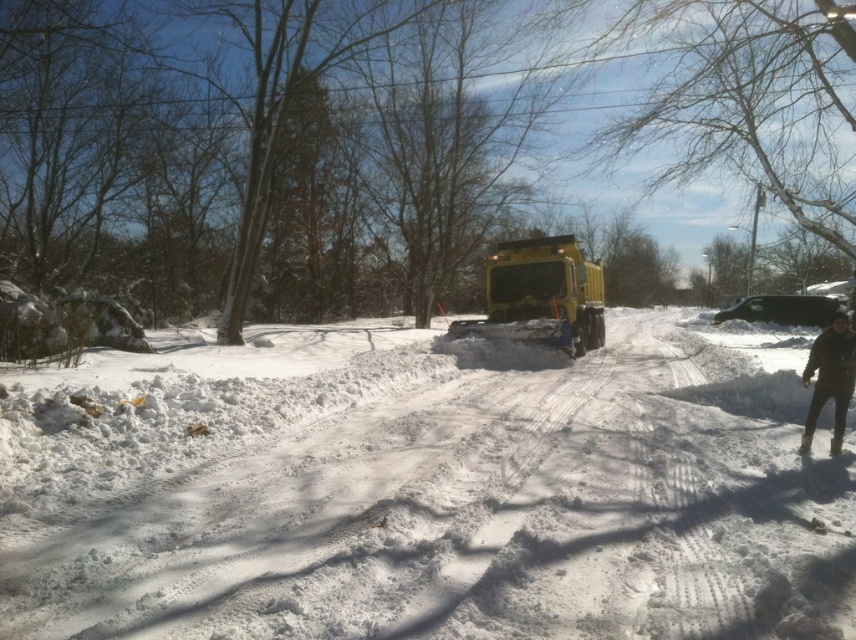
Question: Estimate the real-world distances between objects in this image. Which object is farther from the black fuzzy jacket at lower right?

Choices:
 (A) yellow rubber snowplow at center
 (B) black glossy car at center
 (C) white fluffy snow at center

Answer: (B)

Question: Does yellow rubber snowplow at center have a greater width compared to black glossy car at center?

Choices:
 (A) yes
 (B) no

Answer: (B)

Question: Does white fluffy snow at center appear over yellow rubber snowplow at center?

Choices:
 (A) no
 (B) yes

Answer: (A)

Question: Which point is closer to the camera?

Choices:
 (A) yellow rubber snowplow at center
 (B) white fluffy snow at center
 (C) black fuzzy jacket at lower right

Answer: (B)

Question: Is white fluffy snow at center to the right of black fuzzy jacket at lower right from the viewer's perspective?

Choices:
 (A) yes
 (B) no

Answer: (B)

Question: Which point is farther to the camera?

Choices:
 (A) black fuzzy jacket at lower right
 (B) white fluffy snow at center
 (C) black glossy car at center

Answer: (C)